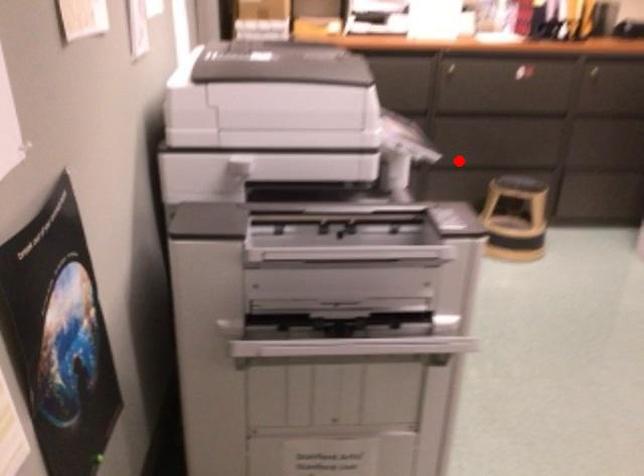
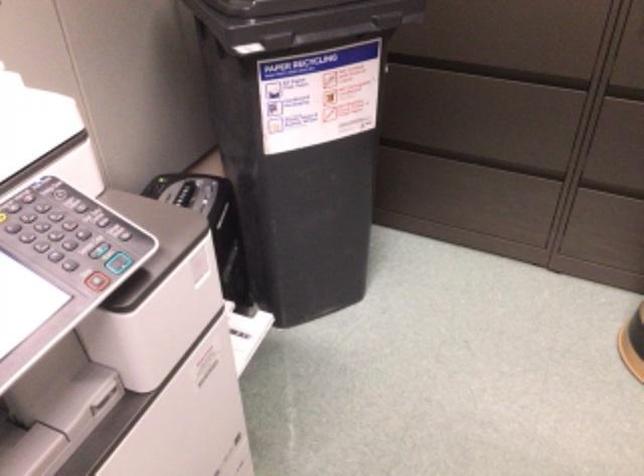
Question: I am providing you with two images of the same scene from different viewpoints. Image1 has a red point marked. In image2, the corresponding 3D location appears at what relative position? Reply with the corresponding letter.

Choices:
 (A) Closer
 (B) Farther

Answer: (A)